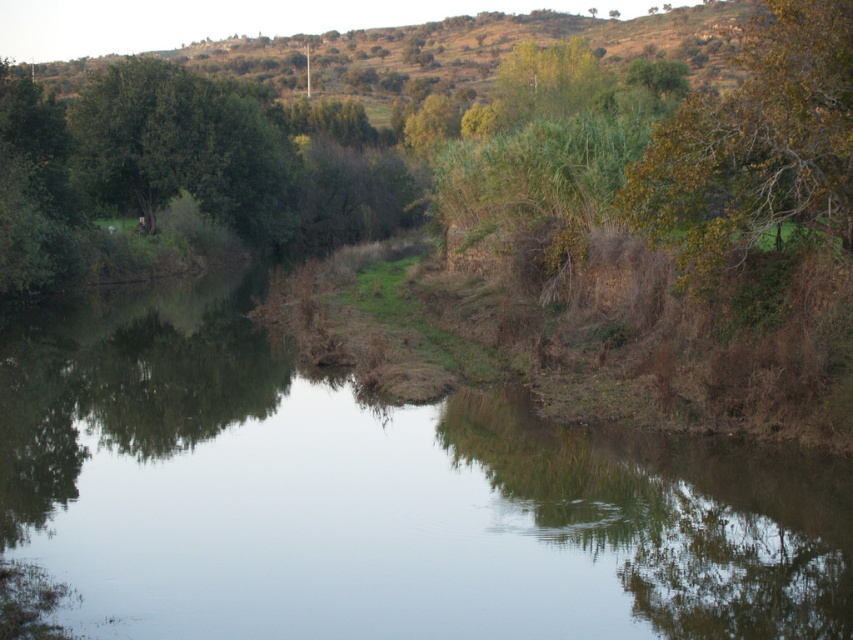
Which is above, green grassy bank at center or green leafy tree at upper right?

green leafy tree at upper right

The image size is (853, 640). Describe the element at coordinates (380, 497) in the screenshot. I see `green grassy bank at center` at that location.

Locate an element on the screen. The width and height of the screenshot is (853, 640). green grassy bank at center is located at coordinates (380, 497).